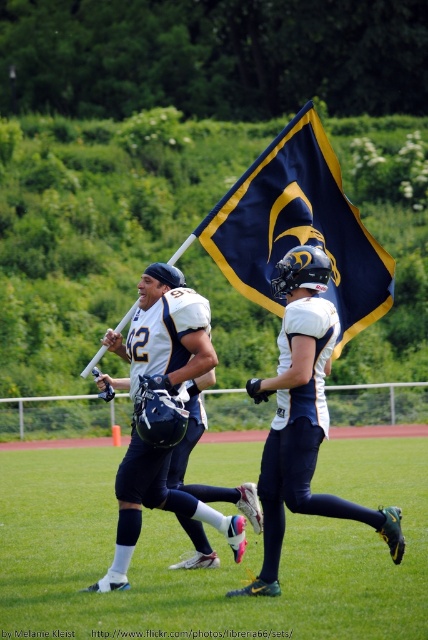
Measure the distance from green grass football field at center to matte white helmet at center.

green grass football field at center is 17.92 feet away from matte white helmet at center.

Does point (262, 634) come farther from viewer compared to point (213, 524)?

That is False.

Who is more forward, (195, 470) or (115, 385)?

Point (115, 385) is in front.

Where is `green grass football field at center`? The height and width of the screenshot is (640, 428). green grass football field at center is located at coordinates (216, 550).

Does navy blue fabric flag at upper center have a greater width compared to matte white helmet at center?

Yes.

Which is in front, point (377, 253) or point (151, 358)?

Point (151, 358) is more forward.

At what (x,y) coordinates should I click in order to perform the action: click on navy blue fabric flag at upper center. Please return your answer as a coordinate pair (x, y). The height and width of the screenshot is (640, 428). Looking at the image, I should click on (299, 227).

The image size is (428, 640). What do you see at coordinates (216, 550) in the screenshot? I see `green grass football field at center` at bounding box center [216, 550].

Based on the photo, does green grass football field at center have a smaller size compared to navy blue fabric flag at upper center?

No, green grass football field at center is not smaller than navy blue fabric flag at upper center.

Describe the element at coordinates (216, 550) in the screenshot. This screenshot has height=640, width=428. I see `green grass football field at center` at that location.

Locate an element on the screen. green grass football field at center is located at coordinates (216, 550).